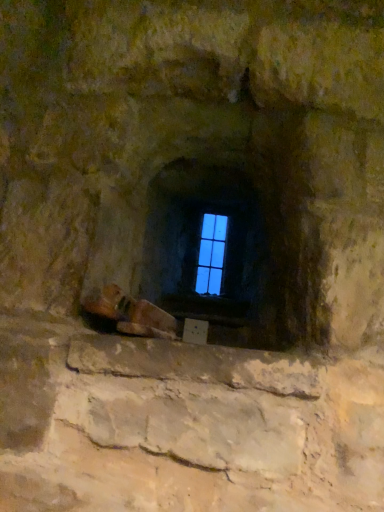
Question: Is blue glass window at center facing away from leather brown shoe at lower center?

Choices:
 (A) yes
 (B) no

Answer: (B)

Question: Could leather brown shoe at lower center be considered to be inside blue glass window at center?

Choices:
 (A) no
 (B) yes

Answer: (A)

Question: Is blue glass window at center positioned in front of leather brown shoe at lower center?

Choices:
 (A) yes
 (B) no

Answer: (B)

Question: Does blue glass window at center have a greater width compared to leather brown shoe at lower center?

Choices:
 (A) yes
 (B) no

Answer: (B)

Question: Can you confirm if blue glass window at center is smaller than leather brown shoe at lower center?

Choices:
 (A) yes
 (B) no

Answer: (A)

Question: From the image's perspective, would you say blue glass window at center is positioned over leather brown shoe at lower center?

Choices:
 (A) yes
 (B) no

Answer: (A)

Question: Does leather brown shoe at lower center appear on the right side of blue glass window at center?

Choices:
 (A) yes
 (B) no

Answer: (B)

Question: Can you confirm if leather brown shoe at lower center is smaller than blue glass window at center?

Choices:
 (A) yes
 (B) no

Answer: (B)

Question: Is leather brown shoe at lower center not within blue glass window at center?

Choices:
 (A) yes
 (B) no

Answer: (A)

Question: From the image's perspective, does leather brown shoe at lower center appear higher than blue glass window at center?

Choices:
 (A) yes
 (B) no

Answer: (B)

Question: Does leather brown shoe at lower center appear on the left side of blue glass window at center?

Choices:
 (A) no
 (B) yes

Answer: (B)

Question: Can you confirm if leather brown shoe at lower center is shorter than blue glass window at center?

Choices:
 (A) no
 (B) yes

Answer: (B)

Question: From a real-world perspective, is blue glass window at center positioned above or below leather brown shoe at lower center?

Choices:
 (A) below
 (B) above

Answer: (B)